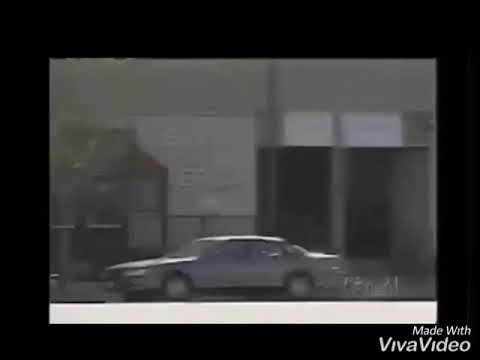
I want to click on entryway, so click(x=313, y=196), click(x=366, y=194).